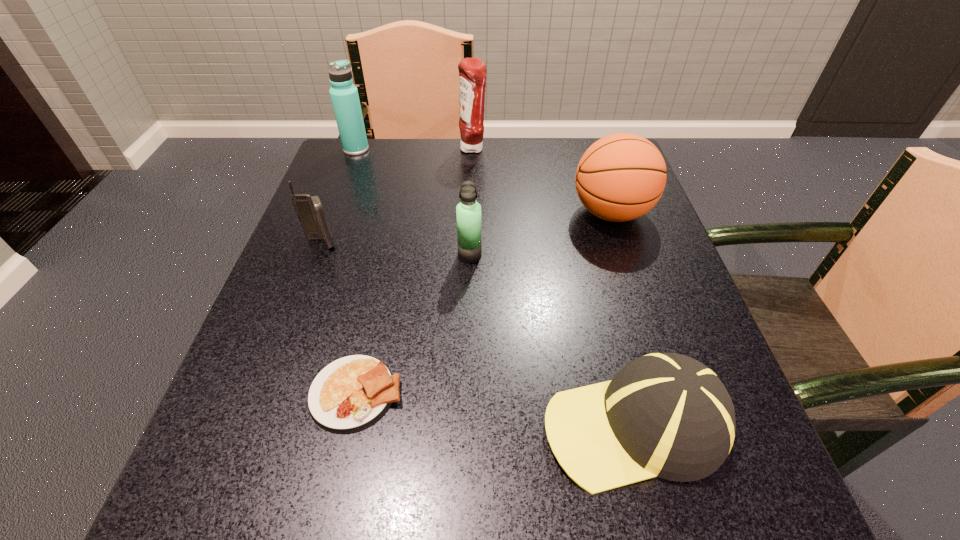
Where is `vacant point located between the right thermos bottle and the taller thermos bottle`? The width and height of the screenshot is (960, 540). vacant point located between the right thermos bottle and the taller thermos bottle is located at coordinates (413, 202).

This screenshot has height=540, width=960. What are the coordinates of `free area in between the basketball and the farther thermos bottle` in the screenshot? It's located at (484, 181).

This screenshot has height=540, width=960. I want to click on free space between the right thermos bottle and the third object from left to right, so click(413, 324).

Find the location of a particular element. The height and width of the screenshot is (540, 960). free space that is in between the second shortest object and the cellular telephone is located at coordinates (478, 334).

I want to click on unoccupied area between the baseball cap and the nearer thermos bottle, so click(552, 340).

Locate an element on the screen. the fourth closest object relative to the cellular telephone is located at coordinates (472, 71).

Find the location of a particular element. Image resolution: width=960 pixels, height=540 pixels. object that ranks as the sixth closest to the basketball is located at coordinates (344, 95).

The image size is (960, 540). I want to click on vacant space that satisfies the following two spatial constraints: 1. on the front side of the left thermos bottle; 2. on the left side of the shortest object, so click(264, 393).

Where is `vacant space that satisfies the following two spatial constraints: 1. on the back side of the basketball; 2. on the right side of the shortest object`? vacant space that satisfies the following two spatial constraints: 1. on the back side of the basketball; 2. on the right side of the shortest object is located at coordinates (396, 213).